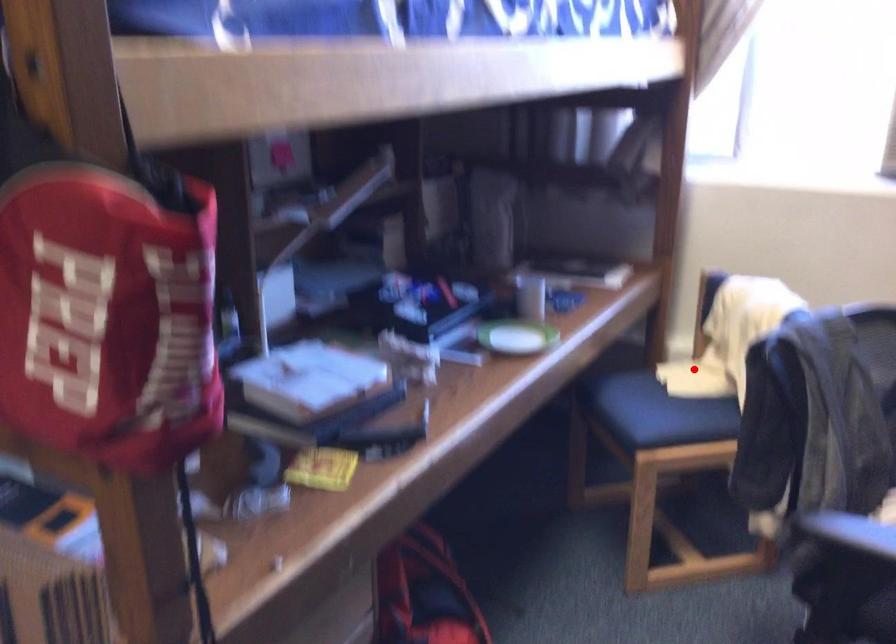
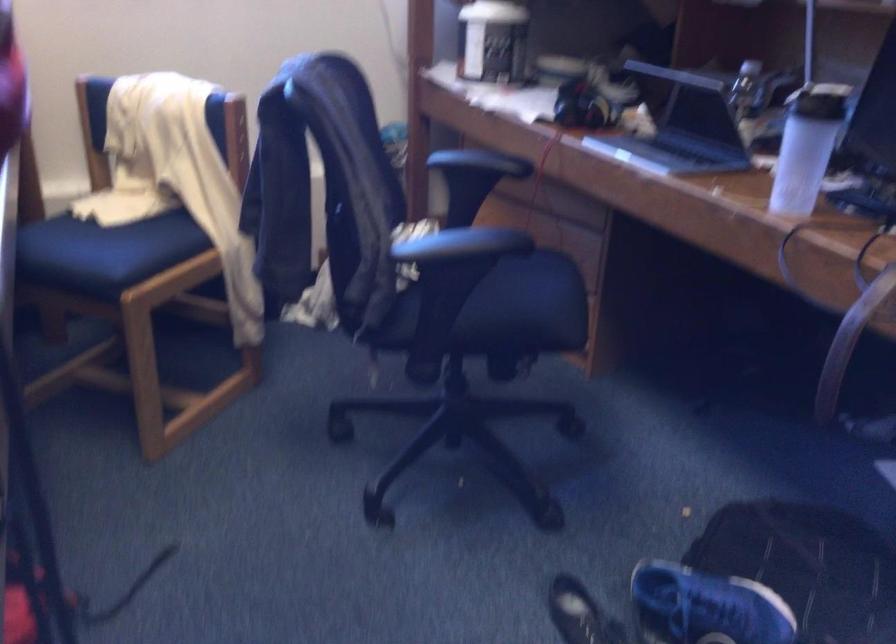
Locate, in the second image, the point that corresponds to the highlighted location in the first image.

(123, 200)